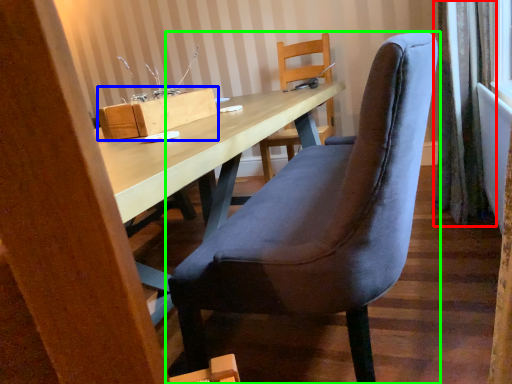
Question: Estimate the real-world distances between objects in this image. Which object is farther from curtain (highlighted by a red box), cardboard box (highlighted by a blue box) or chair (highlighted by a green box)?

Choices:
 (A) cardboard box
 (B) chair

Answer: (A)